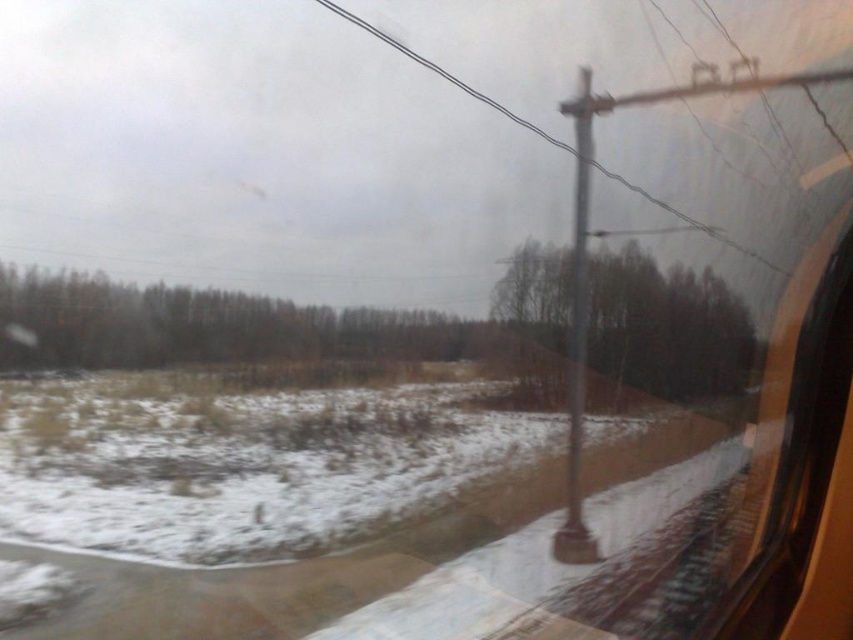
You are sitting in the train and looking at the winter landscape outside. You notice two points marked on the window. The first point is at coordinates point [18,317] and the second is at point [659,200]. Which point is closer to you?

Point [18,317] is further to the viewer than point [659,200], so the point closer to you is point [659,200].

You are standing inside the train and want to know if you can fit a 50 feet long ladder between the green matte trees at center and the brown matte tree at center. Can you fit it?

The distance between the green matte trees at center and the brown matte tree at center is 56.29 feet. Since the ladder is 50 feet long, it can fit between them as the space is larger than the ladder.

You are a passenger on the train and notice two trees outside the window. The green matte trees at center and the brown matte tree at center. Which tree is located to the right?

The brown matte tree at center is located to the right of the green matte trees at center.